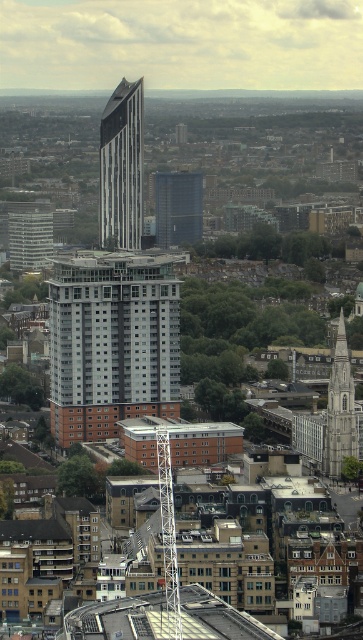
You are navigating an urban planning simulation and need to place a new green park. The park must be positioned such that it is closer to the stone tower at center than to any other building in the scene. Based on the coordinates provided, can you confirm if the park placement at point A is valid?

The stone tower at center is located at point (340, 408). To determine if the park placement at point A is valid, you would need to calculate the distance from point A to the stone tower at center and ensure it is shorter than the distance to all other buildings. However, without specific coordinates for point A or other buildings, I cannot confirm the validity of the placement.

You are a drone operator tasked with flying a drone between the stone tower at center and the white metal spire at center. The drone has a maximum flight distance of 70 meters. Can the drone safely complete the flight between these two structures without exceeding its range?

The distance between the stone tower at center and the white metal spire at center is 72.59 meters, which exceeds the drone operator drone maximum flight distance of 70 meters. The drone cannot safely complete the flight between these two structures without exceeding its range.

You are a drone operator flying over the city. You need to deliver a package to the dark blue glass building at center and the white metal spire at center. According to the image, which building is positioned to the right side when viewed from above?

The dark blue glass building at center is positioned to the right of the white metal spire at center, so the dark blue glass building at center is on the right side.